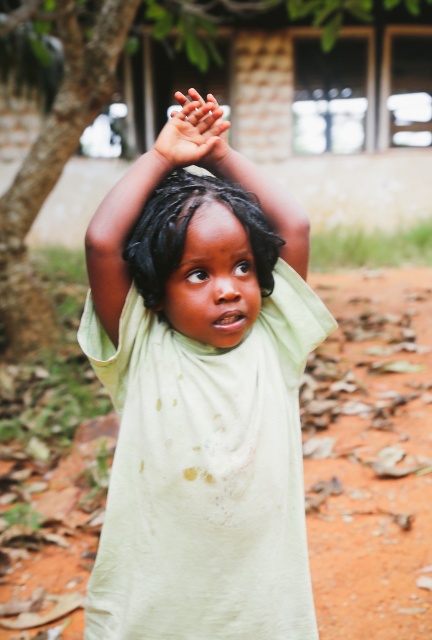
Question: Which point appears farthest from the camera in this image?

Choices:
 (A) (212, 140)
 (B) (15, 346)

Answer: (B)

Question: Estimate the real-world distances between objects in this image. Which object is closer to the black curly hair at center?

Choices:
 (A) green leafy tree at upper left
 (B) light green fabric at center

Answer: (B)

Question: Can you confirm if light green fabric at center is wider than black curly hair at center?

Choices:
 (A) no
 (B) yes

Answer: (B)

Question: Is green leafy tree at upper left bigger than black curly hair at center?

Choices:
 (A) yes
 (B) no

Answer: (A)

Question: Does light green fabric at center have a lesser width compared to green leafy tree at upper left?

Choices:
 (A) yes
 (B) no

Answer: (A)

Question: Which object is closer to the camera taking this photo?

Choices:
 (A) smooth skin hands at upper center
 (B) black curly hair at center
 (C) green leafy tree at upper left
 (D) light green fabric at center

Answer: (A)